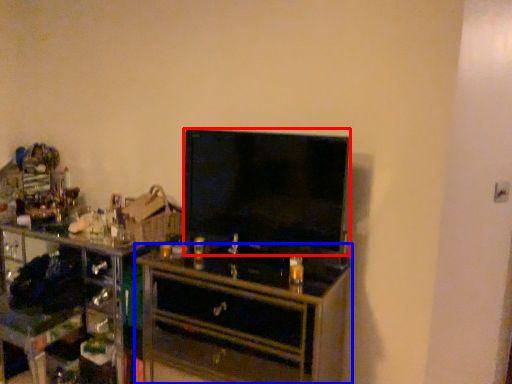
Question: Among these objects, which one is farthest to the camera, television (highlighted by a red box) or chest of drawers (highlighted by a blue box)?

Choices:
 (A) television
 (B) chest of drawers

Answer: (A)